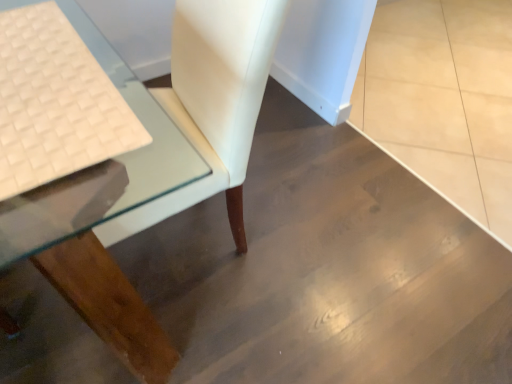
Locate an element on the screen. The image size is (512, 384). free space on the front side of clear glass table at lower left is located at coordinates (167, 336).